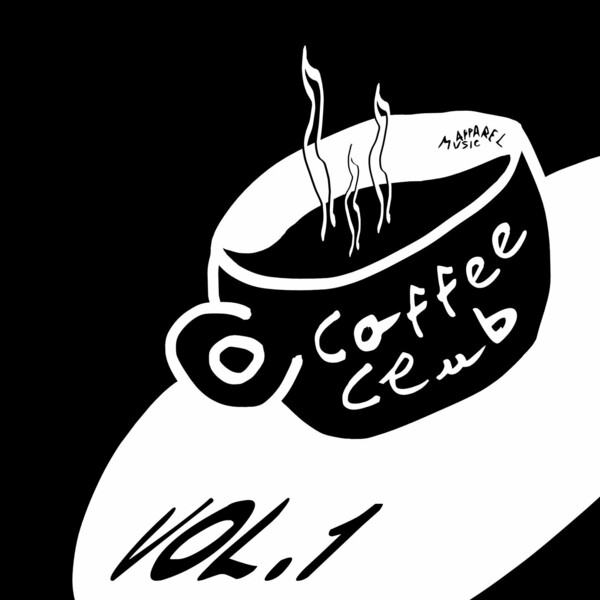
At what (x,y) coordinates should I click in order to perform the action: click on coffee in cup. Please return your answer as a coordinate pair (x, y). Image resolution: width=600 pixels, height=600 pixels. Looking at the image, I should click on (424, 199).